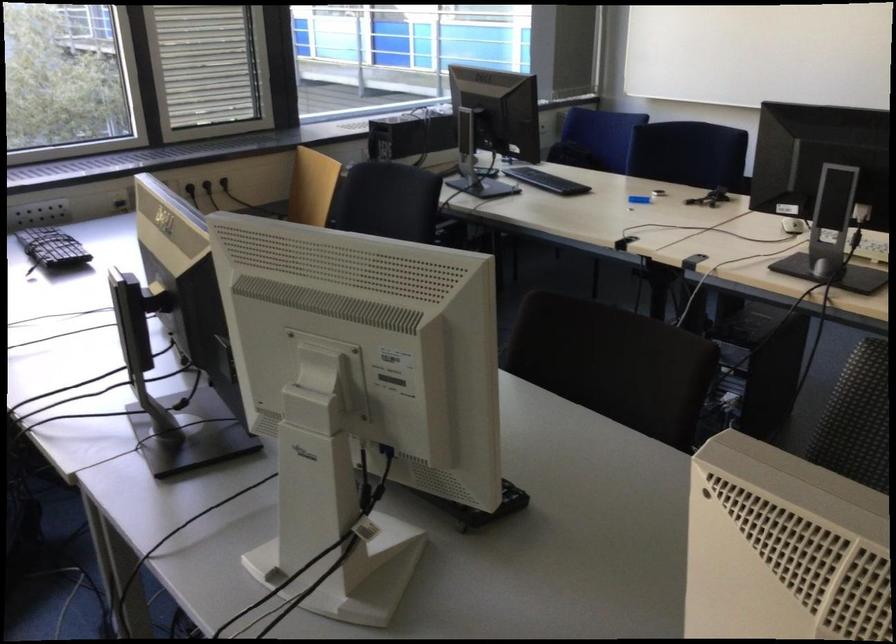
What do you see at coordinates (857, 419) in the screenshot? I see `a patterned chair sitting surface` at bounding box center [857, 419].